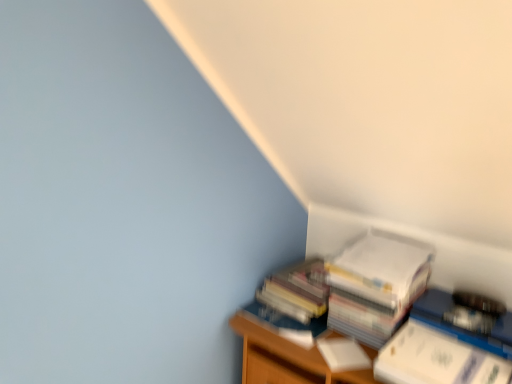
Question: From the image's perspective, is white paper at upper right, which is the 3th paperback book from front to back, above white paper at right, positioned as the first paperback book in front-to-back order?

Choices:
 (A) yes
 (B) no

Answer: (A)

Question: From a real-world perspective, does white paper at upper right, acting as the first paperback book starting from the back, sit lower than white paper at right, the 3th paperback book in the back-to-front sequence?

Choices:
 (A) yes
 (B) no

Answer: (B)

Question: Could you tell me if white paper at upper right, which is the 3th paperback book from front to back, is facing white paper at right, the 3th paperback book in the back-to-front sequence?

Choices:
 (A) no
 (B) yes

Answer: (A)

Question: Considering the relative sizes of white paper at upper right, acting as the first paperback book starting from the back, and white paper at right, the 3th paperback book in the back-to-front sequence, in the image provided, is white paper at upper right, acting as the first paperback book starting from the back, shorter than white paper at right, the 3th paperback book in the back-to-front sequence,?

Choices:
 (A) yes
 (B) no

Answer: (B)

Question: Does white paper at upper right, acting as the first paperback book starting from the back, have a greater width compared to white paper at right, the 3th paperback book in the back-to-front sequence?

Choices:
 (A) no
 (B) yes

Answer: (B)

Question: Which is correct: wooden bookshelf at lower right is inside white matte paperback book at lower right, placed as the second paperback book when sorted from front to back, or outside of it?

Choices:
 (A) outside
 (B) inside

Answer: (A)

Question: Is wooden bookshelf at lower right to the left or to the right of white matte paperback book at lower right, which is the 2th paperback book from back to front, in the image?

Choices:
 (A) left
 (B) right

Answer: (A)

Question: In terms of height, does wooden bookshelf at lower right look taller or shorter compared to white matte paperback book at lower right, which is the 2th paperback book from back to front?

Choices:
 (A) short
 (B) tall

Answer: (B)

Question: Considering the positions of wooden bookshelf at lower right and white matte paperback book at lower right, which is the 2th paperback book from back to front, in the image, is wooden bookshelf at lower right wider or thinner than white matte paperback book at lower right, which is the 2th paperback book from back to front,?

Choices:
 (A) wide
 (B) thin

Answer: (A)

Question: Is white paper stack at lower right situated inside white paper at right, the 3th paperback book in the back-to-front sequence, or outside?

Choices:
 (A) outside
 (B) inside

Answer: (A)

Question: From the image's perspective, is white paper stack at lower right located above or below white paper at right, positioned as the first paperback book in front-to-back order?

Choices:
 (A) below
 (B) above

Answer: (B)

Question: In terms of height, does white paper stack at lower right look taller or shorter compared to white paper at right, the 3th paperback book in the back-to-front sequence?

Choices:
 (A) short
 (B) tall

Answer: (B)

Question: In the image, is white paper stack at lower right positioned in front of or behind white paper at right, the 3th paperback book in the back-to-front sequence?

Choices:
 (A) front
 (B) behind

Answer: (B)

Question: Considering the positions of white paper stack at lower right and white paper at upper right, which is the 3th paperback book from front to back, in the image, is white paper stack at lower right wider or thinner than white paper at upper right, which is the 3th paperback book from front to back,?

Choices:
 (A) thin
 (B) wide

Answer: (A)

Question: From a real-world perspective, is white paper stack at lower right positioned above or below white paper at upper right, acting as the first paperback book starting from the back?

Choices:
 (A) below
 (B) above

Answer: (A)